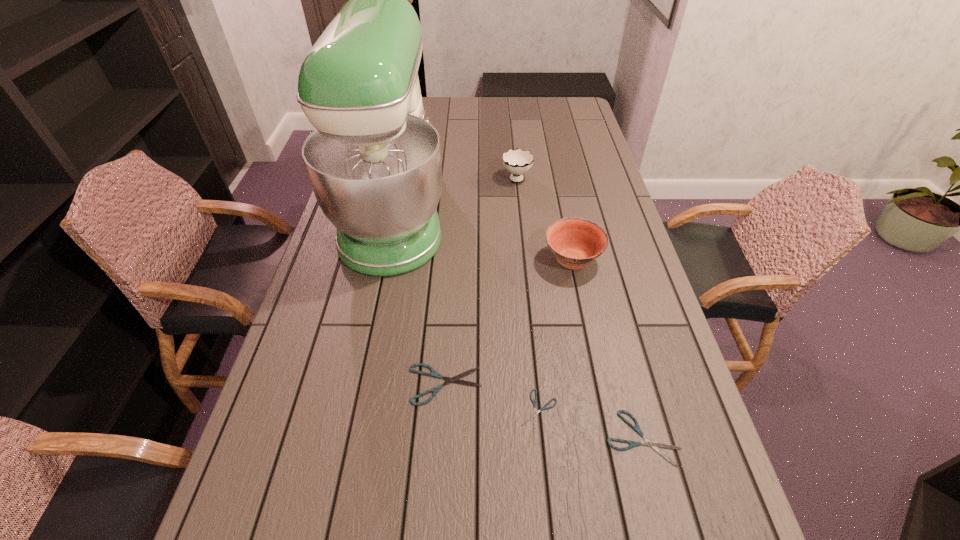
Where is `object located at the near right corner`? Image resolution: width=960 pixels, height=540 pixels. object located at the near right corner is located at coordinates (654, 445).

Image resolution: width=960 pixels, height=540 pixels. I want to click on vacant space at the far edge of the desktop, so click(426, 114).

This screenshot has width=960, height=540. In the image, there is a desktop. What are the coordinates of `blank space at the near edge` in the screenshot? It's located at (603, 487).

Image resolution: width=960 pixels, height=540 pixels. I want to click on vacant space at the right edge of the desktop, so click(602, 172).

Locate an element on the screen. vacant space at the far right corner is located at coordinates [560, 120].

Identify the location of free space at the near right corner. This screenshot has width=960, height=540. (669, 485).

This screenshot has height=540, width=960. What are the coordinates of `free space between the second shortest shears and the second shears from right to left` in the screenshot? It's located at (590, 424).

Find the location of a particular element. The width and height of the screenshot is (960, 540). vacant area that lies between the leftmost shears and the bowl is located at coordinates (509, 322).

At what (x,y) coordinates should I click in order to perform the action: click on free space between the cup and the leftmost shears. Please return your answer as a coordinate pair (x, y). Looking at the image, I should click on (481, 280).

Locate an element on the screen. This screenshot has height=540, width=960. vacant space in between the cup and the leftmost shears is located at coordinates [x=481, y=280].